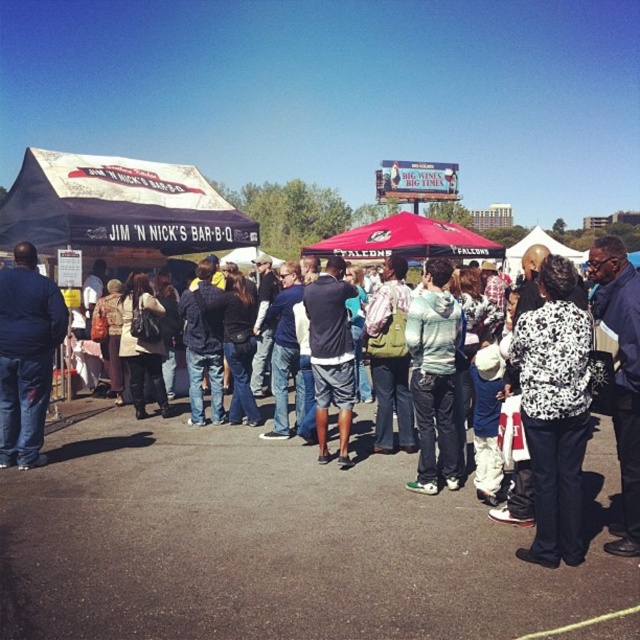
You are a person waiting in line at the barbecue event. You see a light blue hoodie at center and a red fabric canopy at center. Which object is above the other?

The red fabric canopy at center is above the light blue hoodie at center because the light blue hoodie at center is positioned under it.

You are standing at the entrance of the JIM NICK S BAR B Q tent and want to see the person wearing the light blue hoodie at center. In which direction should you look relative to the tent?

The light blue hoodie at center is located at point (435,378) relative to the tent, so you should look towards the center area in front of the tent to see the person wearing it.